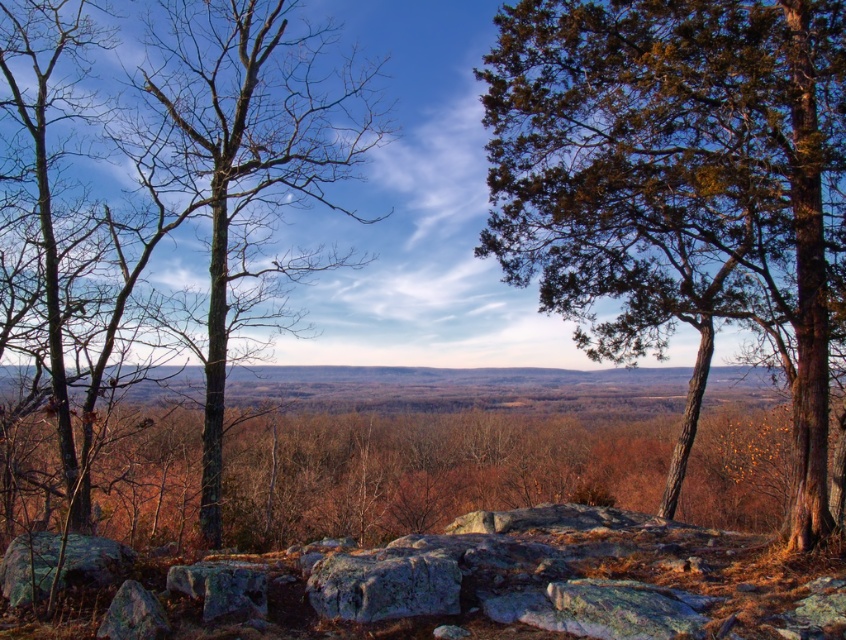
Who is positioned more to the left, gray rough boulder at center or green mossy rock at lower left?

Positioned to the left is green mossy rock at lower left.

Based on the photo, does gray rough boulder at center have a larger size compared to green mossy rock at lower left?

No.

At what (x,y) coordinates should I click in order to perform the action: click on gray rough boulder at center. Please return your answer as a coordinate pair (x, y). This screenshot has height=640, width=846. Looking at the image, I should click on (383, 584).

The image size is (846, 640). Identify the location of gray rough boulder at center. (383, 584).

Who is shorter, green bark tree at left or gray rough boulder at center?

gray rough boulder at center

Which of these two, green bark tree at left or gray rough boulder at center, stands taller?

Standing taller between the two is green bark tree at left.

Is point (273, 115) closer to viewer compared to point (383, 568)?

No, it is not.

Find the location of a particular element. Image resolution: width=846 pixels, height=640 pixels. green bark tree at left is located at coordinates (246, 170).

Can you confirm if green textured tree at upper right is smaller than green bark tree at left?

Yes.

Does green textured tree at upper right appear on the right side of green bark tree at left?

Correct, you'll find green textured tree at upper right to the right of green bark tree at left.

Is point (759, 104) positioned behind point (240, 212)?

No, it is in front of (240, 212).

This screenshot has width=846, height=640. In order to click on green textured tree at upper right in this screenshot , I will do `click(678, 180)`.